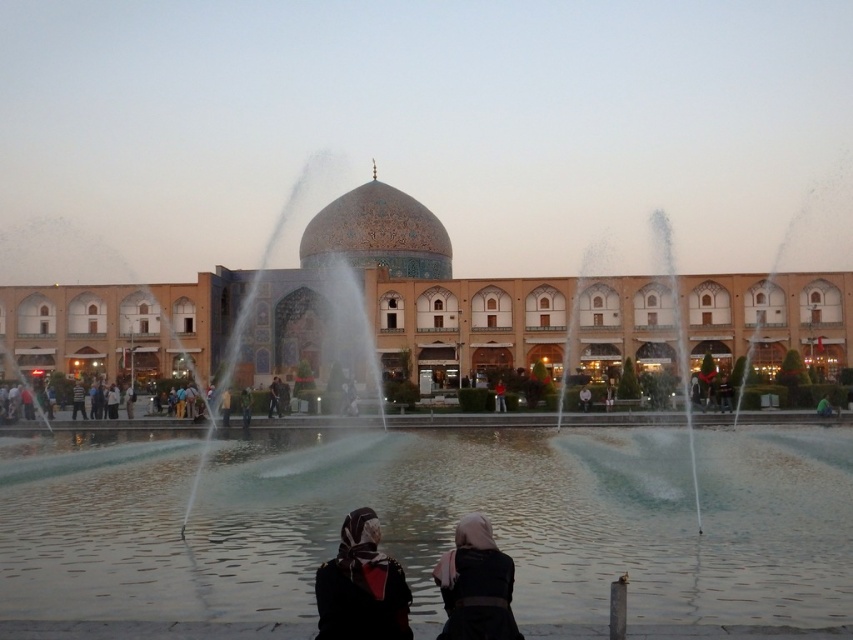
You are a photographer positioned at the camera location. You want to capture a closeup shot of the dark fabric headscarf at center. Given that your camera can focus on objects within 50 meters, will you be able to capture a clear closeup?

The dark fabric headscarf at center is 43.37 meters away from the camera. Since the camera can focus within 50 meters, it is within range, so yes, you can capture a clear closeup.

You are a photographer trying to capture a photo of the red shirt at center and the matte black hijab at lower center. Which object should you adjust your camera focus to first if you want to include both in the frame?

The matte black hijab at lower center is positioned on the left side of red shirt at center. Since they are both in the foreground near the fountain, adjusting focus on either first would work as they are likely at a similar distance. However, if prioritizing the hijab, focus there first.

You are standing at the camera position and want to reach the dark blue fabric at center. The path is clear, but you have a 100 meter limit on your movement. Can you reach it within your limit?

The dark blue fabric at center and camera are 92.52 meters apart from each other, so yes, you can reach it within the 100 meter limit.